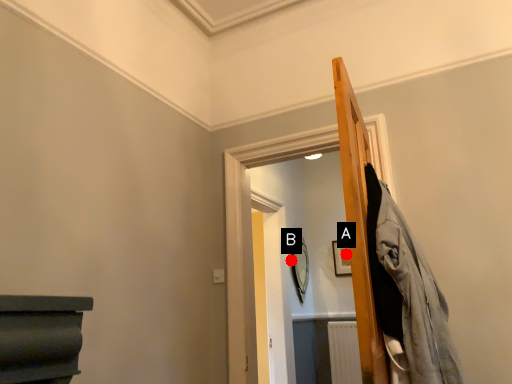
Question: Two points are circled on the image, labeled by A and B beside each circle. Which point is closer to the camera?

Choices:
 (A) A is closer
 (B) B is closer

Answer: (B)